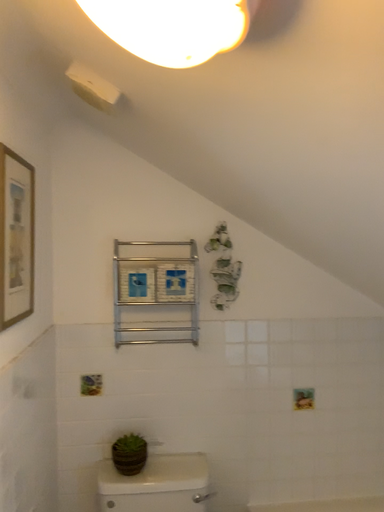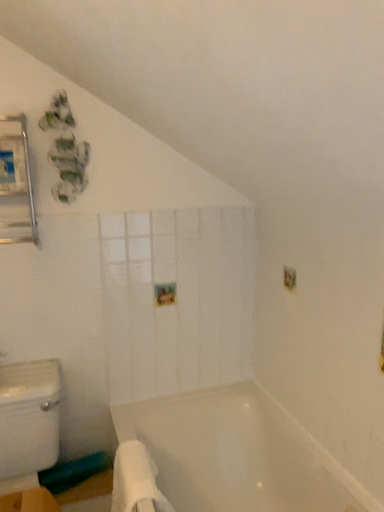
Question: How did the camera likely rotate when shooting the video?

Choices:
 (A) rotated upward
 (B) rotated downward

Answer: (B)